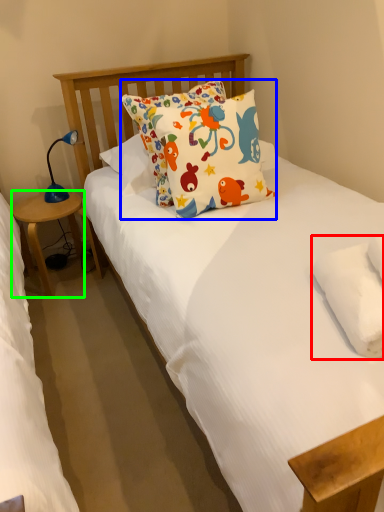
Question: Which is nearer to the pillow (highlighted by a red box)? pillow (highlighted by a blue box) or table (highlighted by a green box).

Choices:
 (A) pillow
 (B) table

Answer: (A)